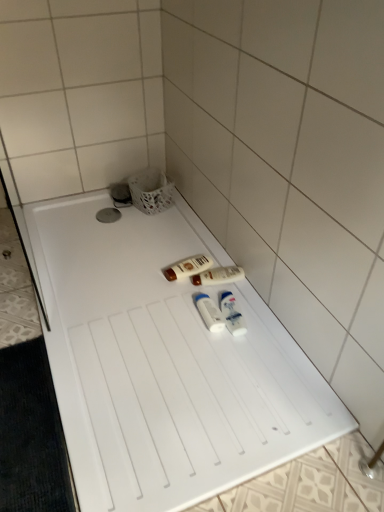
The width and height of the screenshot is (384, 512). What are the coordinates of `free space to the left of white plastic tubes at center, placed as the 3th toiletry when sorted from back to front` in the screenshot? It's located at (162, 317).